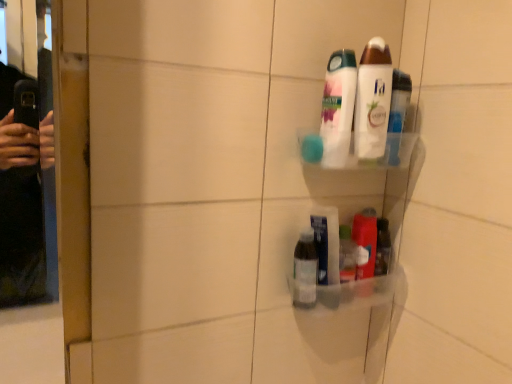
Question: Should I look upward or downward to see transparent plastic bottle at lower center?

Choices:
 (A) down
 (B) up

Answer: (A)

Question: Is translucent plastic container at lower right, which ranks as the 3th toiletry in top-to-bottom order, directly adjacent to clear plastic bottle at lower center, the 4th toiletry in the top-to-bottom sequence?

Choices:
 (A) no
 (B) yes

Answer: (A)

Question: Does translucent plastic container at lower right, the 2th toiletry ordered from the bottom, lie in front of clear plastic bottle at lower center, the 4th toiletry in the top-to-bottom sequence?

Choices:
 (A) yes
 (B) no

Answer: (B)

Question: From the image's perspective, would you say translucent plastic container at lower right, which ranks as the 3th toiletry in top-to-bottom order, is shown under clear plastic bottle at lower center, marked as the first toiletry in a bottom-to-top arrangement?

Choices:
 (A) yes
 (B) no

Answer: (B)

Question: From a real-world perspective, does translucent plastic container at lower right, which ranks as the 3th toiletry in top-to-bottom order, sit lower than clear plastic bottle at lower center, the 4th toiletry in the top-to-bottom sequence?

Choices:
 (A) yes
 (B) no

Answer: (B)

Question: Is clear plastic bottle at lower center, the 4th toiletry in the top-to-bottom sequence, at the back of translucent plastic container at lower right, which ranks as the 3th toiletry in top-to-bottom order?

Choices:
 (A) no
 (B) yes

Answer: (A)

Question: Can you confirm if translucent plastic container at lower right, which ranks as the 3th toiletry in top-to-bottom order, is positioned to the left of clear plastic bottle at lower center, marked as the first toiletry in a bottom-to-top arrangement?

Choices:
 (A) no
 (B) yes

Answer: (A)

Question: From a real-world perspective, is white glossy body wash at upper center, the 2th toiletry positioned from the top, located higher than white glossy lotion at upper center, the 4th toiletry ordered from the bottom?

Choices:
 (A) no
 (B) yes

Answer: (A)

Question: Considering the relative sizes of white glossy body wash at upper center, marked as the 3th toiletry in a bottom-to-top arrangement, and white glossy lotion at upper center, which is the 1th toiletry from top to bottom, in the image provided, is white glossy body wash at upper center, marked as the 3th toiletry in a bottom-to-top arrangement, shorter than white glossy lotion at upper center, which is the 1th toiletry from top to bottom,?

Choices:
 (A) yes
 (B) no

Answer: (A)

Question: Can you confirm if white glossy body wash at upper center, the 2th toiletry positioned from the top, is taller than white glossy lotion at upper center, the 4th toiletry ordered from the bottom?

Choices:
 (A) no
 (B) yes

Answer: (A)

Question: Is white glossy body wash at upper center, marked as the 3th toiletry in a bottom-to-top arrangement, wider than white glossy lotion at upper center, which is the 1th toiletry from top to bottom?

Choices:
 (A) no
 (B) yes

Answer: (B)

Question: Does white glossy body wash at upper center, marked as the 3th toiletry in a bottom-to-top arrangement, have a smaller size compared to white glossy lotion at upper center, the 4th toiletry ordered from the bottom?

Choices:
 (A) no
 (B) yes

Answer: (A)

Question: Would you say white glossy body wash at upper center, the 2th toiletry positioned from the top, is outside white glossy lotion at upper center, which is the 1th toiletry from top to bottom?

Choices:
 (A) no
 (B) yes

Answer: (B)

Question: Is white glossy lotion at upper center, which is the 1th toiletry from top to bottom, wider than translucent plastic container at lower right, which ranks as the 3th toiletry in top-to-bottom order?

Choices:
 (A) no
 (B) yes

Answer: (A)